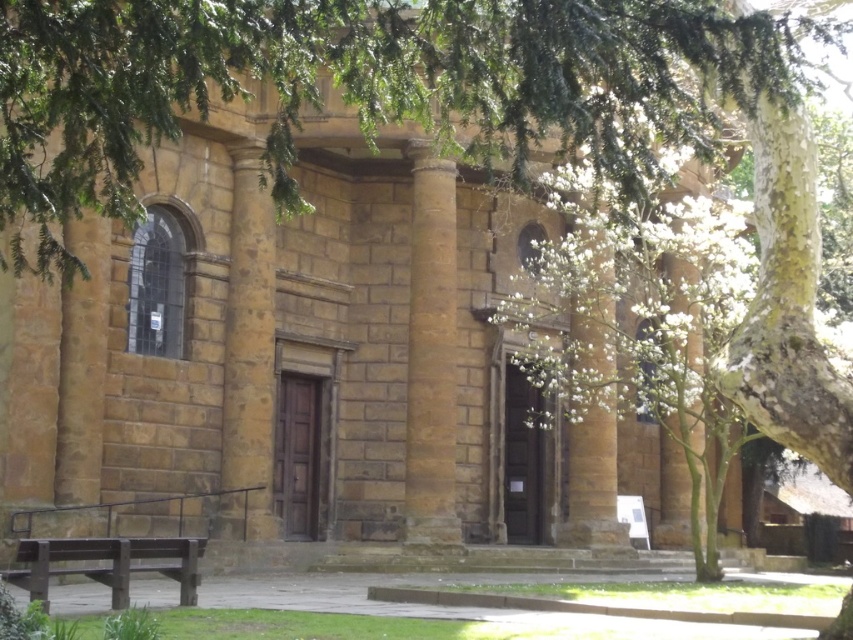
Who is taller, green leafy branches at upper center or brown stone column at center?

brown stone column at center is taller.

Is point (123, 92) closer to camera compared to point (430, 166)?

Yes, it is.

The image size is (853, 640). Find the location of `green leafy branches at upper center`. green leafy branches at upper center is located at coordinates (363, 86).

Does brown stone column at center appear on the left side of brown wooden bench at lower left?

Incorrect, brown stone column at center is not on the left side of brown wooden bench at lower left.

Is point (440, 358) farther from viewer compared to point (167, 573)?

Yes, point (440, 358) is behind point (167, 573).

Between point (450, 445) and point (61, 545), which one is positioned in front?

Positioned in front is point (61, 545).

This screenshot has height=640, width=853. Identify the location of brown stone column at center. (431, 353).

Looking at this image, can you confirm if green leafy branches at upper center is thinner than brown wooden bench at lower left?

Incorrect, green leafy branches at upper center's width is not less than brown wooden bench at lower left's.

Between point (474, 51) and point (173, 579), which one is positioned behind?

Point (173, 579)

What do you see at coordinates (363, 86) in the screenshot?
I see `green leafy branches at upper center` at bounding box center [363, 86].

Identify the location of green leafy branches at upper center. This screenshot has height=640, width=853. (363, 86).